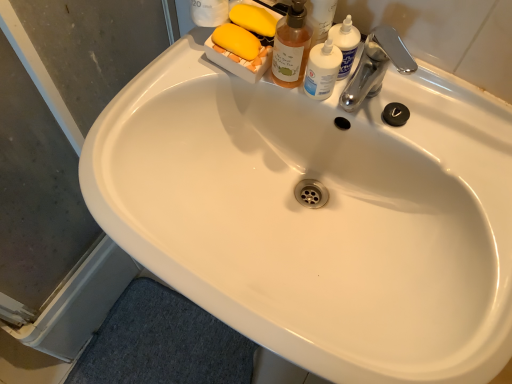
Question: From the image's perspective, is translucent amber bottle at upper right positioned above or below transparent glass screen door at lower left?

Choices:
 (A) below
 (B) above

Answer: (B)

Question: Do you think translucent amber bottle at upper right is within transparent glass screen door at lower left, or outside of it?

Choices:
 (A) inside
 (B) outside

Answer: (B)

Question: Based on their relative distances, which object is farther from the translucent plastic bottle at upper right?

Choices:
 (A) silver metallic faucet at upper right
 (B) transparent glass screen door at lower left
 (C) translucent amber bottle at upper right

Answer: (B)

Question: Which object is the farthest from the silver metallic faucet at upper right?

Choices:
 (A) translucent amber bottle at upper right
 (B) translucent plastic bottle at upper right
 (C) transparent glass screen door at lower left

Answer: (C)